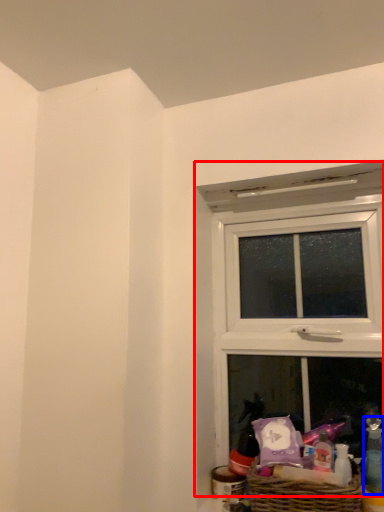
Question: Which object is further to the camera taking this photo, window (highlighted by a red box) or toiletry (highlighted by a blue box)?

Choices:
 (A) window
 (B) toiletry

Answer: (A)